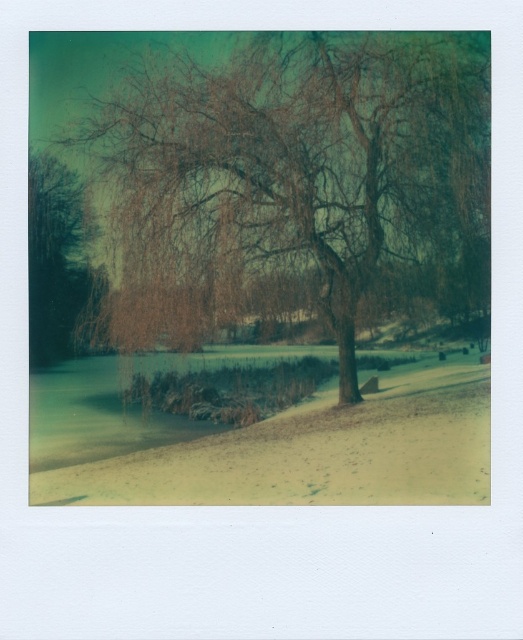
You are an observer standing in the snow near the brown textured tree at center and the brown matte tree at left. Which tree has a wider base?

The brown textured tree at center has a wider base than the brown matte tree at left since its width surpasses the other.

You are standing in the snowy park scene shown in the Polaroid photograph. You notice two points marked in the image. The first point is located at coordinates point (326, 125), and the second point is at point (77, 180). Which of these two points is nearer to your current position?

Point (326, 125) is closer to the viewer than point (77, 180), so the first point is nearer to your current position.